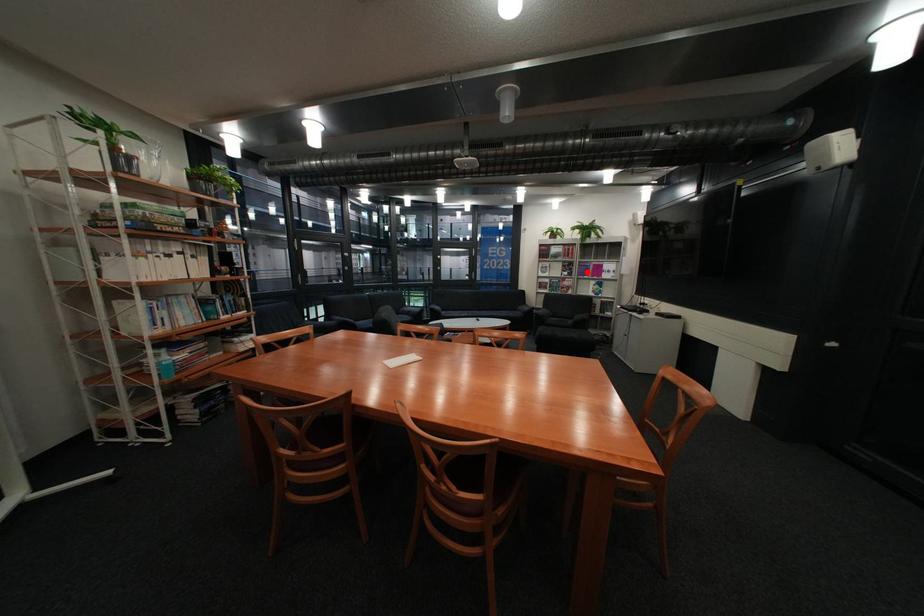
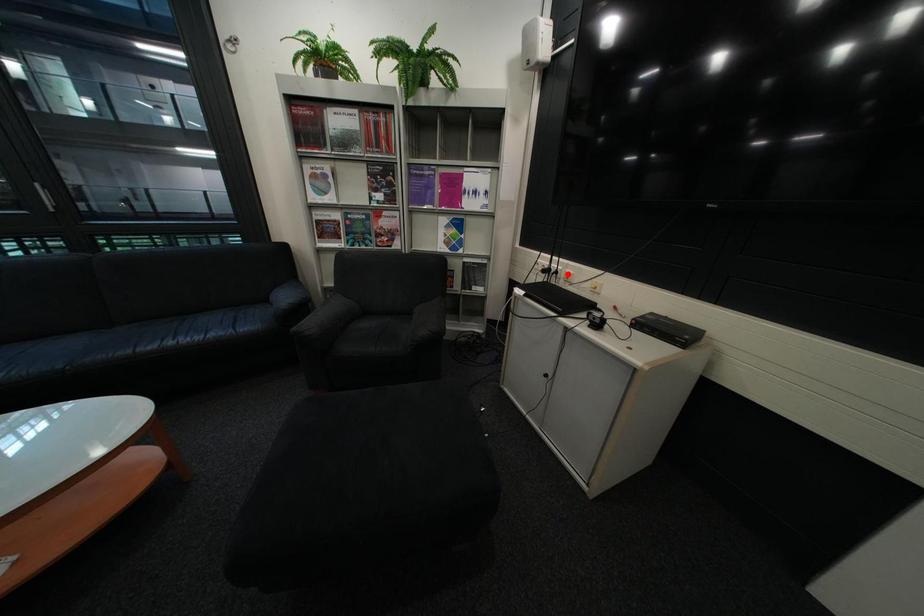
I am providing you with two images of the same scene from different viewpoints. A red point is marked on the first image and another point is marked on the second image. Are the points marked in image1 and image2 representing the same 3D position?

No